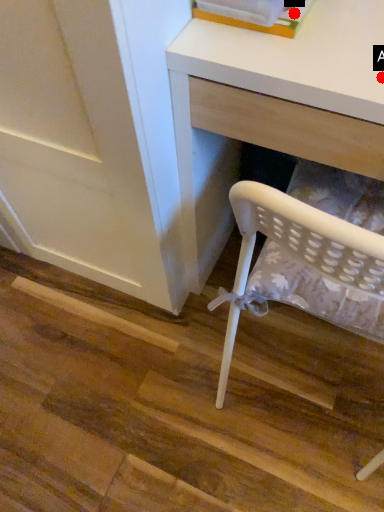
Question: Two points are circled on the image, labeled by A and B beside each circle. Which point is farther from the camera taking this photo?

Choices:
 (A) A is further
 (B) B is further

Answer: (B)